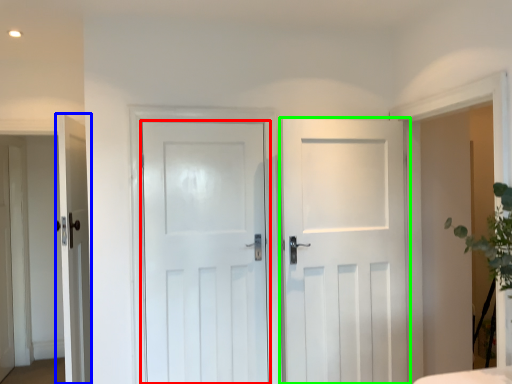
Question: Which is farther away from door (highlighted by a red box)? door (highlighted by a blue box) or door (highlighted by a green box)?

Choices:
 (A) door
 (B) door

Answer: (A)